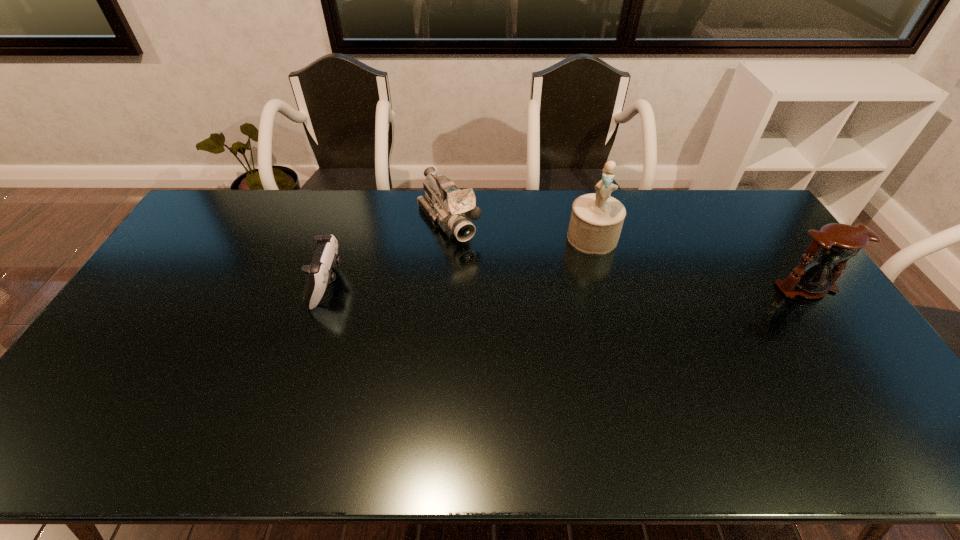
Image resolution: width=960 pixels, height=540 pixels. I want to click on the shortest object, so click(319, 273).

Where is `the leftmost object`? Image resolution: width=960 pixels, height=540 pixels. the leftmost object is located at coordinates (319, 273).

Where is `hourglass`? The width and height of the screenshot is (960, 540). hourglass is located at coordinates (836, 243).

Identify the location of the tallest object. [596, 221].

The width and height of the screenshot is (960, 540). I want to click on the second object from right to left, so click(596, 221).

Where is `camcorder`? camcorder is located at coordinates (445, 205).

Image resolution: width=960 pixels, height=540 pixels. I want to click on blank area located on the front-facing side of the control, so click(400, 285).

The image size is (960, 540). Find the location of `vacant region located 0.230m on the front of the hourglass`. vacant region located 0.230m on the front of the hourglass is located at coordinates (860, 366).

Locate an element on the screen. vacant space located at the beak of the tallest object is located at coordinates (587, 270).

What are the coordinates of `free space located at the beak of the tallest object` in the screenshot? It's located at (585, 286).